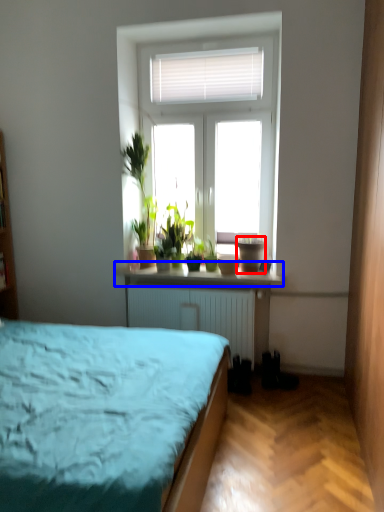
Question: Among these objects, which one is farthest to the camera, flowerpot (highlighted by a red box) or window sill (highlighted by a blue box)?

Choices:
 (A) flowerpot
 (B) window sill

Answer: (A)